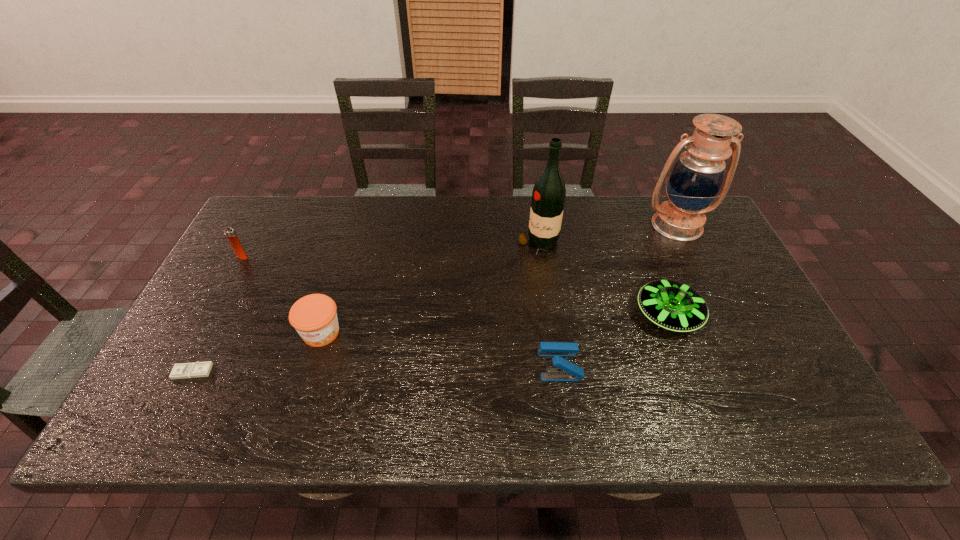
Where is `vacant region between the stapler and the fifth shortest object`? vacant region between the stapler and the fifth shortest object is located at coordinates (401, 311).

Locate an element on the screen. The image size is (960, 540). vacant area that lies between the stapler and the wine bottle is located at coordinates (549, 305).

Where is `blank region between the fifth shortest object and the saucer`? This screenshot has width=960, height=540. blank region between the fifth shortest object and the saucer is located at coordinates (455, 286).

Image resolution: width=960 pixels, height=540 pixels. I want to click on unoccupied position between the third object from left to right and the saucer, so click(x=494, y=324).

At what (x,y) coordinates should I click in order to perform the action: click on free point between the oil lamp and the wine bottle. Please return your answer as a coordinate pair (x, y). This screenshot has height=540, width=960. Looking at the image, I should click on (608, 235).

Where is `vacant space that's between the wine bottle and the saucer`? vacant space that's between the wine bottle and the saucer is located at coordinates (603, 280).

Where is `object that stands as the third closest to the wine bottle`? object that stands as the third closest to the wine bottle is located at coordinates (567, 371).

Find the location of a particular element. This screenshot has height=540, width=960. object that stands as the closest to the jam is located at coordinates (198, 369).

I want to click on vacant region that satisfies the following two spatial constraints: 1. on the front side of the igniter; 2. on the left side of the saucer, so click(210, 315).

You are a GUI agent. You are given a task and a screenshot of the screen. Output one action in this format:
    pyautogui.click(x=<x>, y=<y>)
    Task: Click on the blank area in the image that satisfies the following two spatial constraints: 1. on the back side of the wine bottle; 2. on the right side of the money
    The image size is (960, 540).
    Given the screenshot: What is the action you would take?
    pyautogui.click(x=258, y=246)